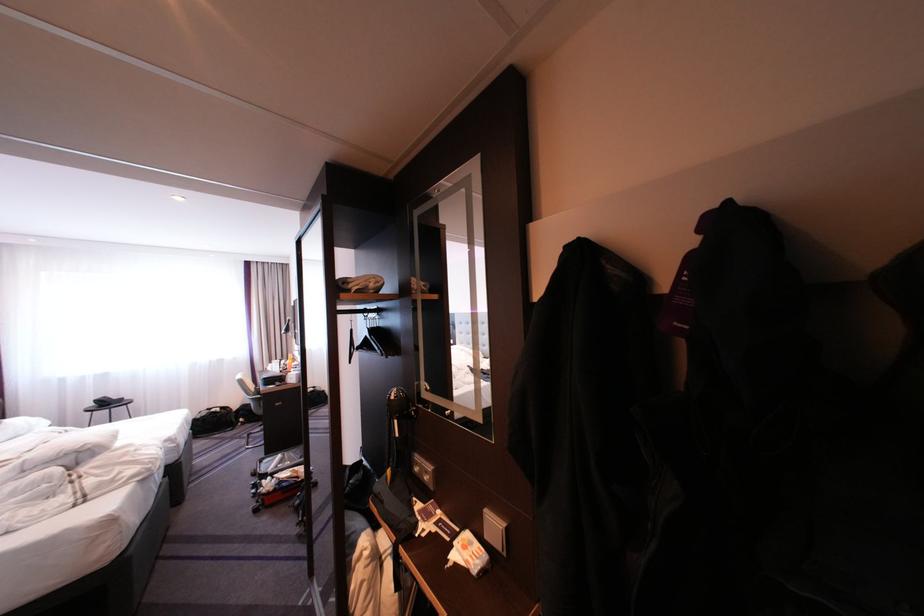
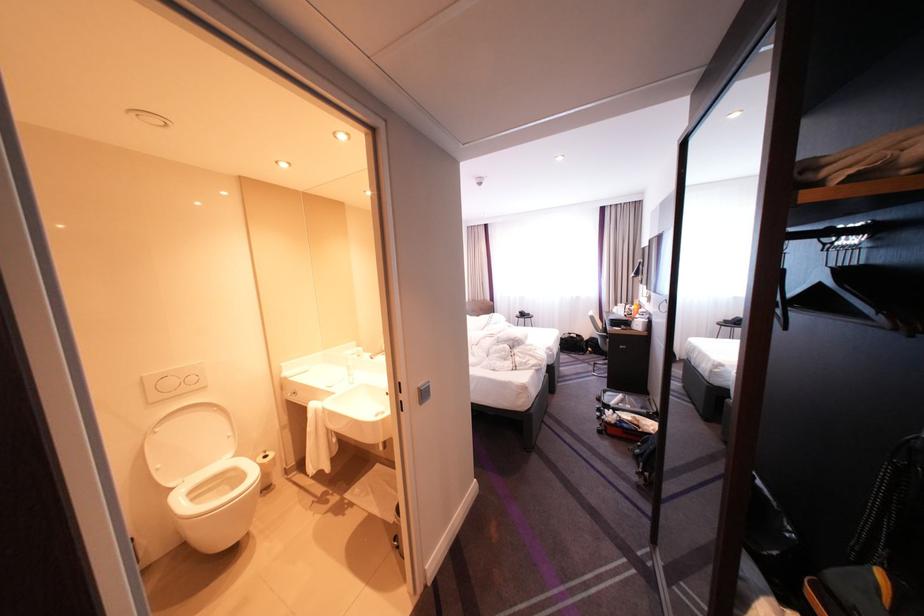
The point at (383, 328) is marked in the first image. Where is the corresponding point in the second image?

(855, 265)